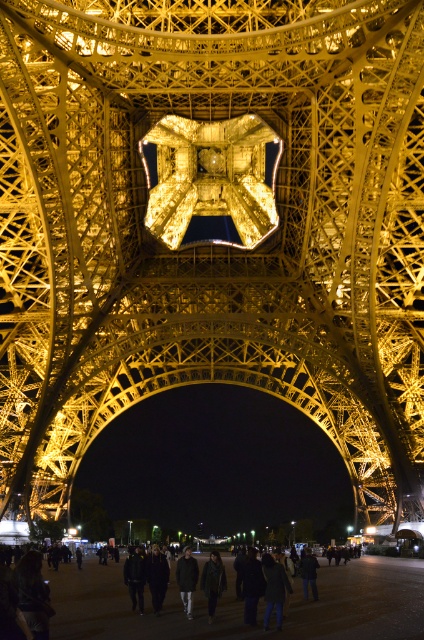
Is dark gray leather jacket at center positioned behind dark gray fabric jacket at center?

No.

Where is `dark gray leather jacket at center`? The image size is (424, 640). dark gray leather jacket at center is located at coordinates (212, 580).

Who is more forward, (119, 621) or (187, 548)?

Point (119, 621)

Who is higher up, dark gray coat at lower center or dark gray fabric jacket at center?

dark gray fabric jacket at center is above.

Which is behind, point (137, 624) or point (192, 564)?

Point (192, 564)

Identify the location of dark gray coat at lower center. (195, 605).

Does point (106, 580) come behind point (201, 584)?

Yes, point (106, 580) is behind point (201, 584).

Where is `dark gray coat at lower center`? This screenshot has height=640, width=424. dark gray coat at lower center is located at coordinates (195, 605).

Is point (116, 609) in front of point (219, 564)?

No, it is not.

Find the location of `dark gray coat at lower center`. dark gray coat at lower center is located at coordinates (195, 605).